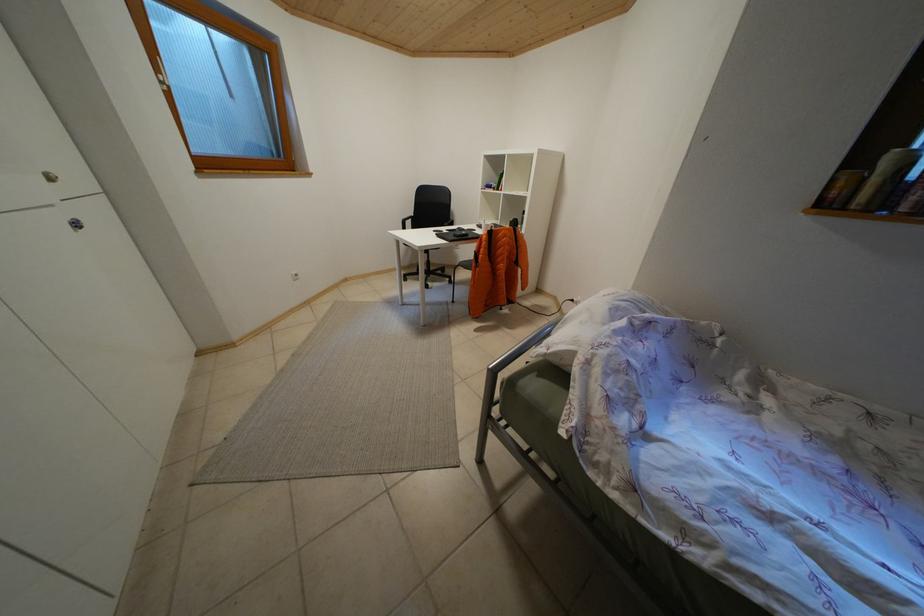
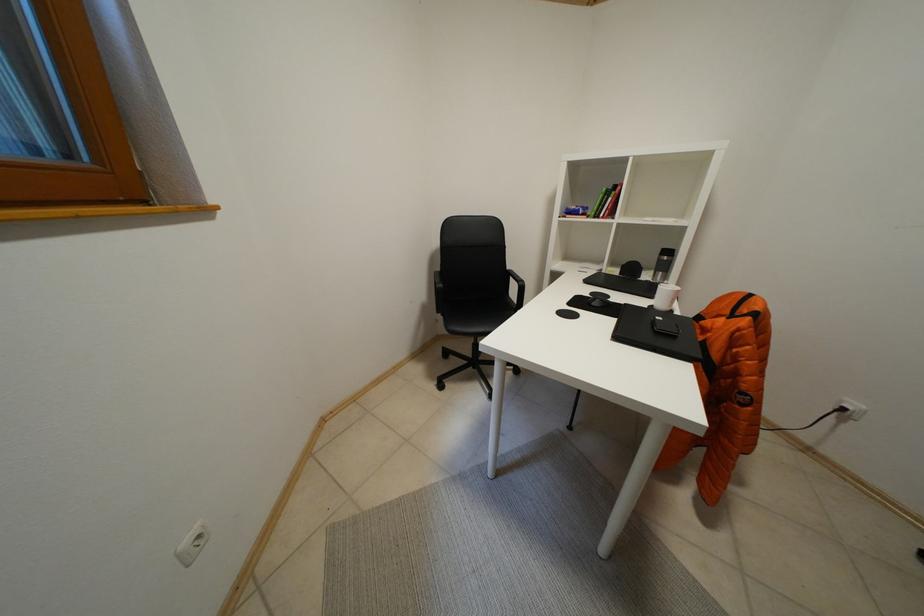
Which direction would the cameraman need to move to produce the second image?

The movement direction of the cameraman is left, forward.